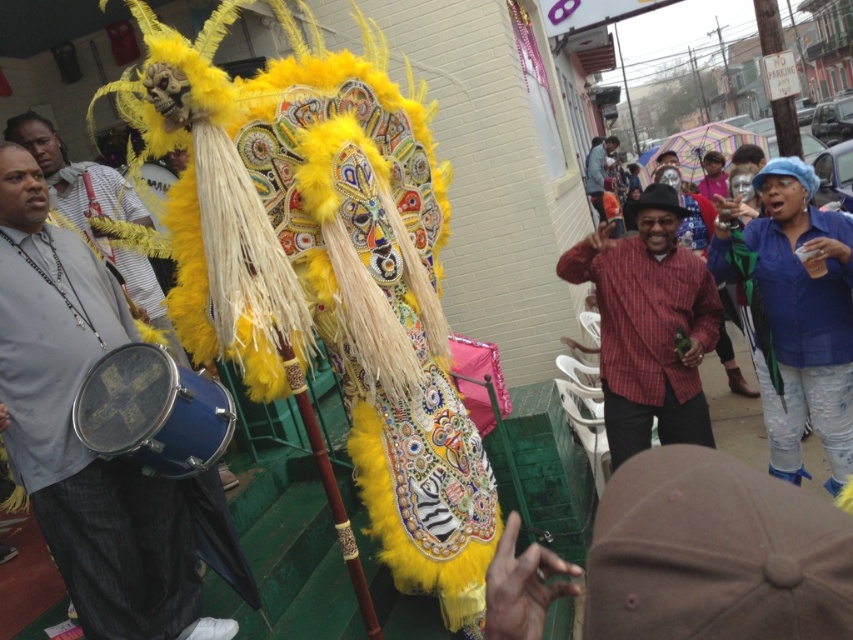
Question: Estimate the real-world distances between objects in this image. Which object is farther from the feathered yellow costume at center?

Choices:
 (A) blue denim jeans at lower right
 (B) matte blue drum at center
 (C) matte red shirt at center

Answer: (C)

Question: Does blue denim jeans at lower right appear on the right side of feathered yellow costume at center?

Choices:
 (A) no
 (B) yes

Answer: (B)

Question: Considering the relative positions of blue denim jeans at lower right and matte red shirt at center in the image provided, where is blue denim jeans at lower right located with respect to matte red shirt at center?

Choices:
 (A) above
 (B) below

Answer: (B)

Question: Which of the following is the closest to the observer?

Choices:
 (A) pyautogui.click(x=33, y=180)
 (B) pyautogui.click(x=585, y=157)
 (C) pyautogui.click(x=608, y=396)
 (D) pyautogui.click(x=120, y=250)

Answer: (A)

Question: In this image, where is matte blue drum at center located relative to blue denim jeans at lower right?

Choices:
 (A) below
 (B) above

Answer: (A)

Question: Estimate the real-world distances between objects in this image. Which object is closer to the red plaid shirt at center?

Choices:
 (A) matte blue drum at center
 (B) matte red shirt at center

Answer: (A)